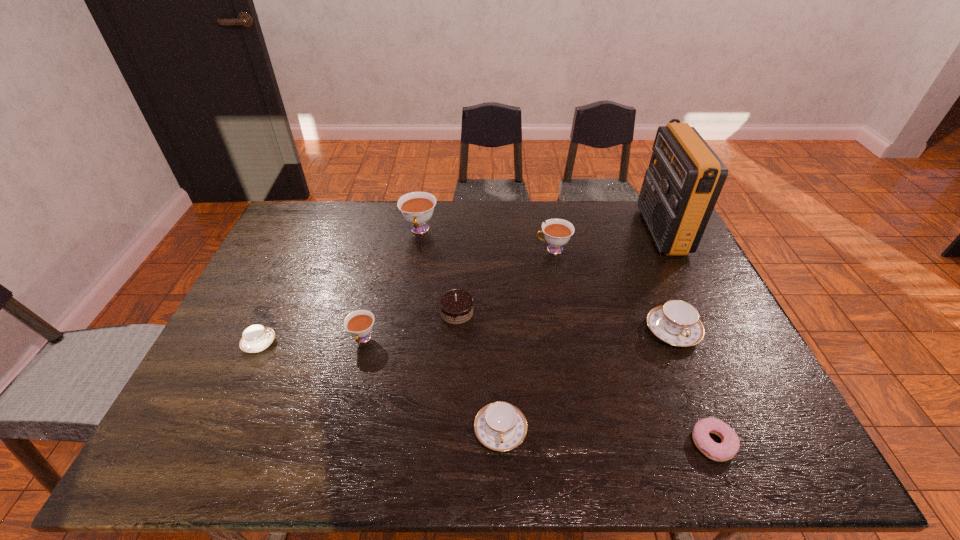
Locate an element on the screen. Image resolution: width=960 pixels, height=540 pixels. vacant space located on the side of the second teacup from right to left with the handle is located at coordinates (440, 249).

You are a GUI agent. You are given a task and a screenshot of the screen. Output one action in this format:
    pyautogui.click(x=<x>, y=<y>)
    Task: Click on the free space located 0.090m on the side of the second teacup from right to left with the handle
    The height and width of the screenshot is (540, 960).
    Given the screenshot: What is the action you would take?
    pyautogui.click(x=508, y=249)

Identify the location of free point located on the side of the second teacup from right to left with the handle. (511, 249).

Locate an element on the screen. This screenshot has height=540, width=960. free region located on the side with the handle of the rightmost teacup is located at coordinates (690, 375).

This screenshot has height=540, width=960. Find the location of `free space located 0.380m on the right of the fourth object from left to right`. free space located 0.380m on the right of the fourth object from left to right is located at coordinates (605, 312).

Locate an element on the screen. This screenshot has width=960, height=540. vacant space located 0.050m on the side of the nearest white teacup with the handle is located at coordinates (356, 368).

Locate an element on the screen. vacant space located 0.230m on the side with the handle of the smallest blue teacup is located at coordinates (361, 343).

Where is `free space located on the left of the shortest object`? This screenshot has height=540, width=960. free space located on the left of the shortest object is located at coordinates (570, 443).

Find the location of a particular element. The image size is (960, 540). radio receiver present at the far edge is located at coordinates [685, 177].

Locate an element on the screen. This screenshot has width=960, height=540. teacup present at the near edge is located at coordinates (500, 426).